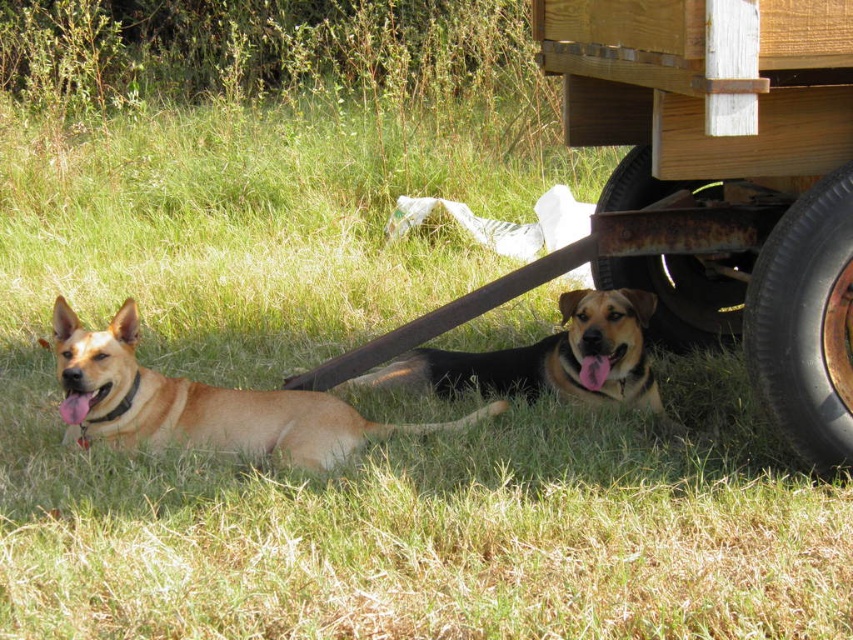
You are a photographer trying to capture the brown fur dog at lower center in the center of your photo. Given the dog is currently at coordinates 0.562 on the x axis and 0.644 on the y axis, will you need to move the camera to the left or right to center the dog horizontally?

The brown fur dog at lower center is located at coordinates 0.562 on the x axis and 0.644 on the y axis. To center it horizontally, since the x coordinate is 0.562 which is slightly to the right of the center point of 0.5, you should move the camera to the right to bring the dog into the center position.

You are a dog owner trying to decide which dog bed to buy for your two dogs. The golden fur dog at left and the brown fur dog at lower center both need beds. Based on their sizes, which dog requires a larger bed?

The golden fur dog at left requires a larger bed since its width is greater than the brown fur dog at lower center.